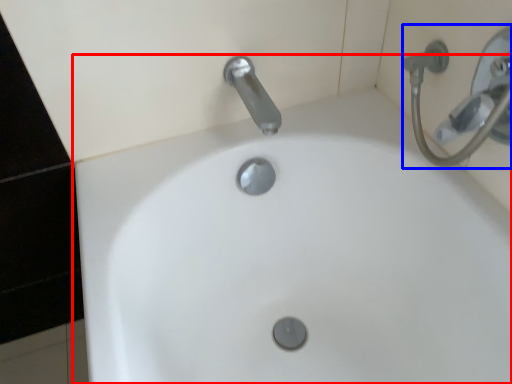
Question: Among these objects, which one is farthest to the camera, sink (highlighted by a red box) or shower (highlighted by a blue box)?

Choices:
 (A) sink
 (B) shower

Answer: (B)